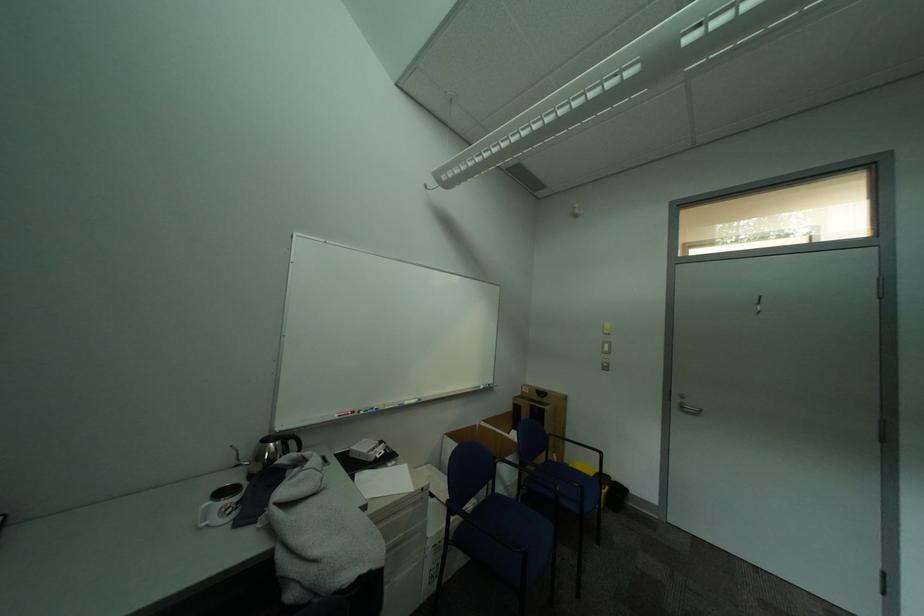
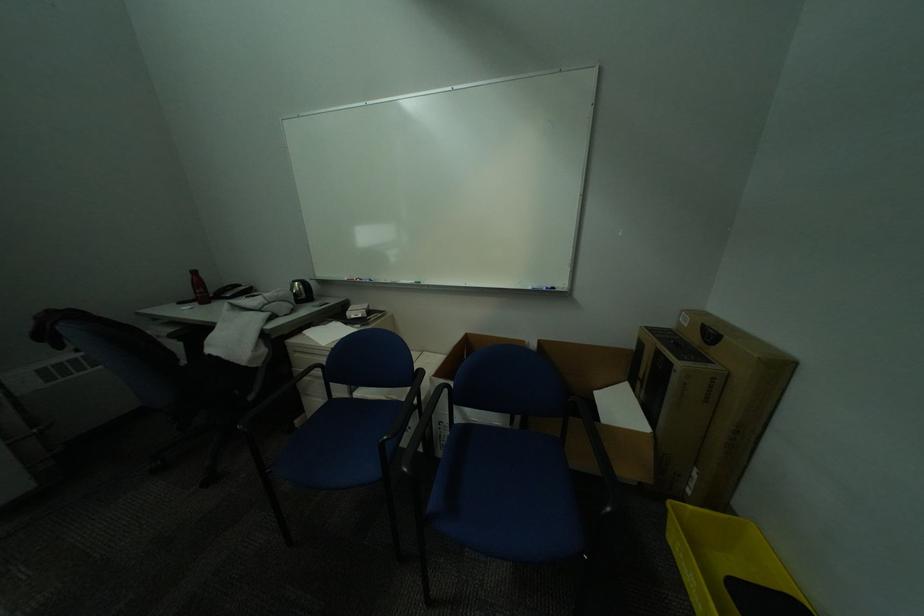
In the second image, find the point that corresponds to (492,387) in the first image.

(541, 289)